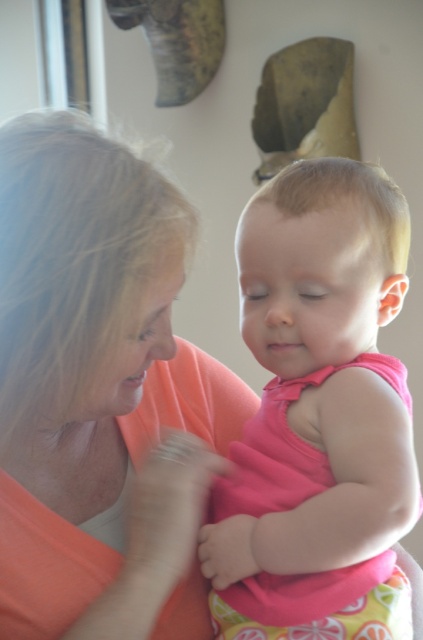
Question: Does matte orange shirt at center have a smaller size compared to pink fabric toddler at center?

Choices:
 (A) yes
 (B) no

Answer: (B)

Question: Does matte orange shirt at center appear on the left side of pink fabric toddler at center?

Choices:
 (A) yes
 (B) no

Answer: (A)

Question: From the image, what is the correct spatial relationship of matte orange shirt at center in relation to pink fabric toddler at center?

Choices:
 (A) below
 (B) above

Answer: (B)